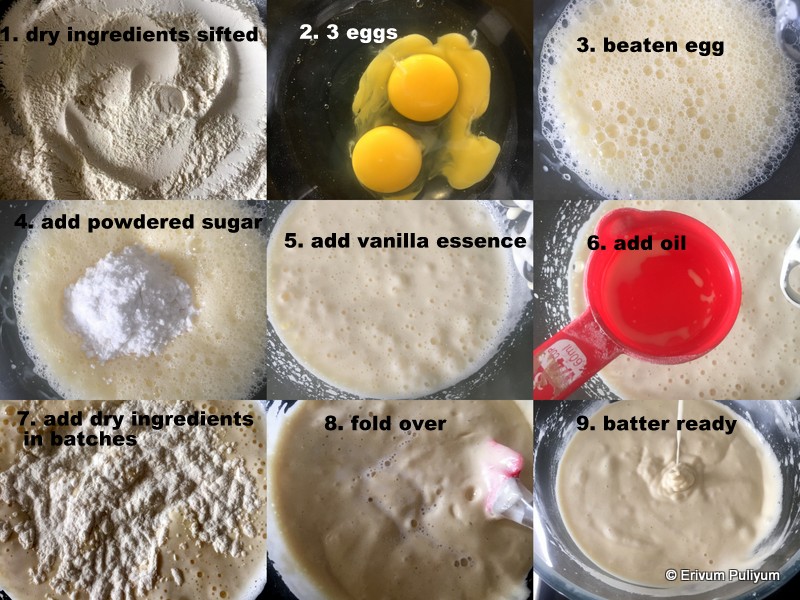
Locate an element on the screen. The image size is (800, 600). red measuring cup is located at coordinates (676, 302).